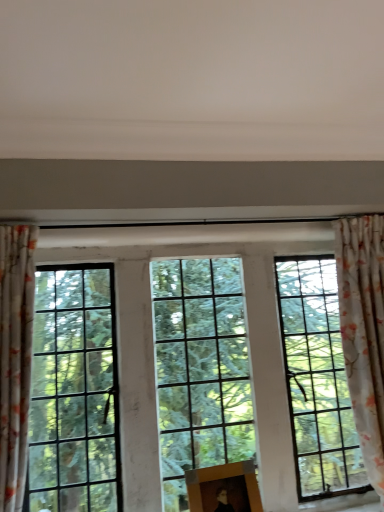
Question: Are clear glass window at center and wooden picture frame at center located far from each other?

Choices:
 (A) no
 (B) yes

Answer: (A)

Question: Is clear glass window at center thinner than wooden picture frame at center?

Choices:
 (A) yes
 (B) no

Answer: (A)

Question: Is wooden picture frame at center at the back of clear glass window at center?

Choices:
 (A) yes
 (B) no

Answer: (A)

Question: Does clear glass window at center appear on the left side of wooden picture frame at center?

Choices:
 (A) no
 (B) yes

Answer: (B)

Question: Would you say wooden picture frame at center is part of clear glass window at center's contents?

Choices:
 (A) yes
 (B) no

Answer: (B)

Question: Based on their sizes in the image, would you say floral fabric curtain at left, which is the 2th curtain from back to front, is bigger or smaller than wooden picture frame at center?

Choices:
 (A) small
 (B) big

Answer: (B)

Question: From a real-world perspective, is floral fabric curtain at left, which is the 2th curtain from back to front, positioned above or below wooden picture frame at center?

Choices:
 (A) above
 (B) below

Answer: (A)

Question: Looking at their shapes, would you say floral fabric curtain at left, positioned as the first curtain in front-to-back order, is wider or thinner than wooden picture frame at center?

Choices:
 (A) wide
 (B) thin

Answer: (A)

Question: From their relative heights in the image, would you say floral fabric curtain at left, positioned as the first curtain in front-to-back order, is taller or shorter than wooden picture frame at center?

Choices:
 (A) tall
 (B) short

Answer: (A)

Question: From a real-world perspective, is clear glass window at center above or below floral fabric curtain at right, positioned as the first curtain in right-to-left order?

Choices:
 (A) below
 (B) above

Answer: (A)

Question: From their relative heights in the image, would you say clear glass window at center is taller or shorter than floral fabric curtain at right, which is the 2th curtain from front to back?

Choices:
 (A) short
 (B) tall

Answer: (A)

Question: Considering their positions, is clear glass window at center located in front of or behind floral fabric curtain at right, marked as the first curtain in a back-to-front arrangement?

Choices:
 (A) front
 (B) behind

Answer: (A)

Question: In terms of width, does clear glass window at center look wider or thinner when compared to floral fabric curtain at right, which is the 2th curtain from front to back?

Choices:
 (A) thin
 (B) wide

Answer: (A)

Question: In the image, is floral fabric curtain at left, the second curtain positioned from the right, positioned in front of or behind floral fabric curtain at right, which appears as the second curtain when viewed from the left?

Choices:
 (A) front
 (B) behind

Answer: (A)

Question: Is floral fabric curtain at left, positioned as the first curtain in front-to-back order, taller or shorter than floral fabric curtain at right, which appears as the second curtain when viewed from the left?

Choices:
 (A) short
 (B) tall

Answer: (A)